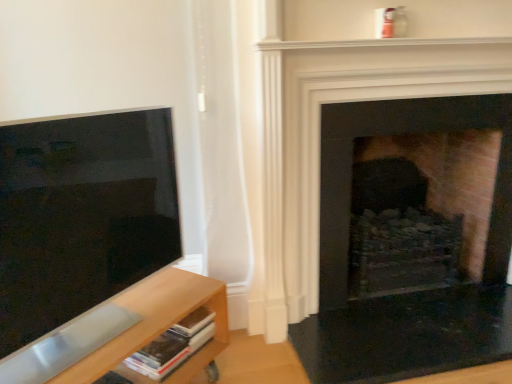
Question: Is light wood shelf at lower left facing towards matte black screen at left?

Choices:
 (A) yes
 (B) no

Answer: (B)

Question: Is light wood shelf at lower left positioned far away from matte black screen at left?

Choices:
 (A) yes
 (B) no

Answer: (B)

Question: Does light wood shelf at lower left have a greater width compared to matte black screen at left?

Choices:
 (A) yes
 (B) no

Answer: (A)

Question: Considering the relative sizes of light wood shelf at lower left and matte black screen at left in the image provided, is light wood shelf at lower left shorter than matte black screen at left?

Choices:
 (A) no
 (B) yes

Answer: (B)

Question: Is light wood shelf at lower left bigger than matte black screen at left?

Choices:
 (A) yes
 (B) no

Answer: (A)

Question: Is light wood shelf at lower left further to camera compared to matte black screen at left?

Choices:
 (A) no
 (B) yes

Answer: (B)

Question: From the image's perspective, does brick fireplace at center, marked as the 2th fireplace in a back-to-front arrangement, appear higher than light wood shelf at lower left?

Choices:
 (A) yes
 (B) no

Answer: (A)

Question: Is brick fireplace at center, placed as the 1th fireplace when sorted from front to back, facing towards light wood shelf at lower left?

Choices:
 (A) yes
 (B) no

Answer: (B)

Question: Does brick fireplace at center, marked as the 2th fireplace in a back-to-front arrangement, have a lesser width compared to light wood shelf at lower left?

Choices:
 (A) yes
 (B) no

Answer: (A)

Question: Is brick fireplace at center, placed as the 1th fireplace when sorted from front to back, positioned behind light wood shelf at lower left?

Choices:
 (A) no
 (B) yes

Answer: (B)

Question: Is brick fireplace at center, placed as the 1th fireplace when sorted from front to back, positioned beyond the bounds of light wood shelf at lower left?

Choices:
 (A) no
 (B) yes

Answer: (B)

Question: Is brick fireplace at center, placed as the 1th fireplace when sorted from front to back, facing away from light wood shelf at lower left?

Choices:
 (A) yes
 (B) no

Answer: (B)

Question: Is the position of brick fireplace at right, positioned as the 1th fireplace in back-to-front order, less distant than that of brick fireplace at center, marked as the 2th fireplace in a back-to-front arrangement?

Choices:
 (A) yes
 (B) no

Answer: (B)